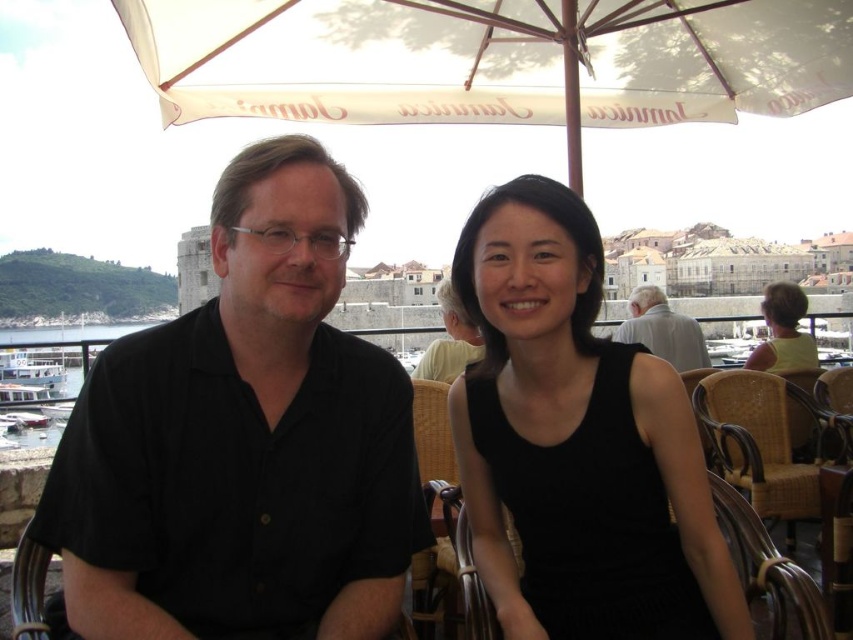
Where is the black shirt at left located in the image?

The black shirt at left is located at point 0.689 on the x axis and 0.287 on the y axis.

You are a photographer trying to capture a clear shot of the matte black shirt at center without the black sleeveless dress at center blocking it. What should you do?

The black sleeveless dress at center is in front of the matte black shirt at center, so you should move the camera angle to position the matte black shirt at center in front of the black sleeveless dress at center or move the dress aside to ensure the shirt is visible.